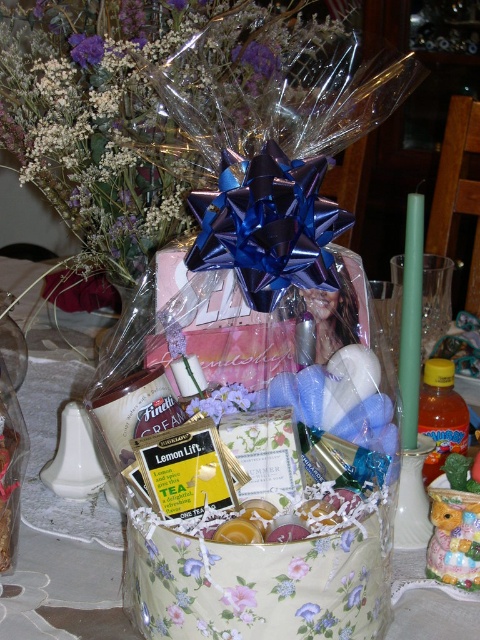
You are standing in front of the gift basket and want to reach for an item. If you extend your hand towards the point labeled point (58, 570) and point (319, 611), which point will your hand touch first?

Point (58, 570) is closer to you than point (319, 611), so your hand will touch point (58, 570) first.

In the scene shown: You are planning to gift this basket and want to ensure that the translucent plastic bouquet at upper center and the pink fabric flower at center are both visible. Based on their sizes, which one should be placed on top to ensure visibility?

The translucent plastic bouquet at upper center is larger than the pink fabric flower at center, so placing the pink fabric flower at center on top would allow both to be visible since the smaller one can be placed higher without blocking the larger one.

You are standing in front of the gift basket and want to reach both the point at coordinates point [156,20] and point [193,400]. Which point will you reach first?

You will reach point [156,20] first because it is closer to you than point [193,400], which is further away.